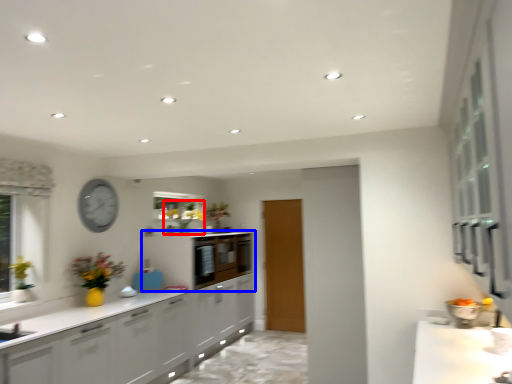
Question: Which point is further to the camera, floral arrangement (highlighted by a red box) or cabinetry (highlighted by a blue box)?

Choices:
 (A) floral arrangement
 (B) cabinetry

Answer: (B)